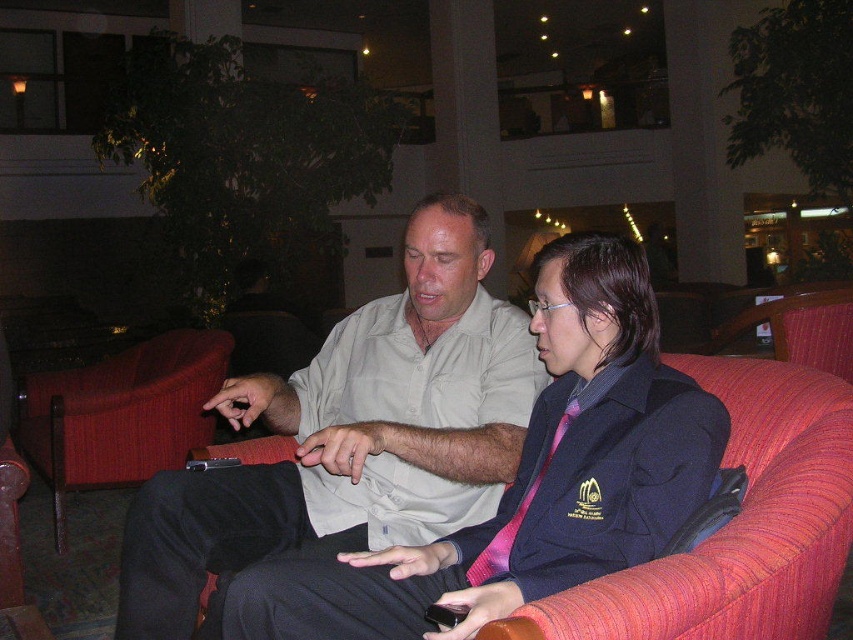
Based on the photo, you are standing 5 feet away from the sofa in the hotel lobby. You want to toss a small object to the person wearing the light beige shirt at center. Is the distance within your throwing range?

The light beige shirt at center is 4.95 feet away from the camera, so yes, the distance is within your throwing range since it is slightly less than 5 feet.

You are standing in the hotel lobby and need to locate the light beige shirt at center. According to the coordinates provided, where would you look to find it?

The light beige shirt at center is located at the 2D coordinates point [351,435].

You are a guest in the hotel lobby and want to sit next to the person on the red fabric couch at right. Which direction should you move from the red fabric armchair at left to reach the couch?

The red fabric couch at right is located above the red fabric armchair at left, so you should move upward from the red fabric armchair at left to reach the couch.